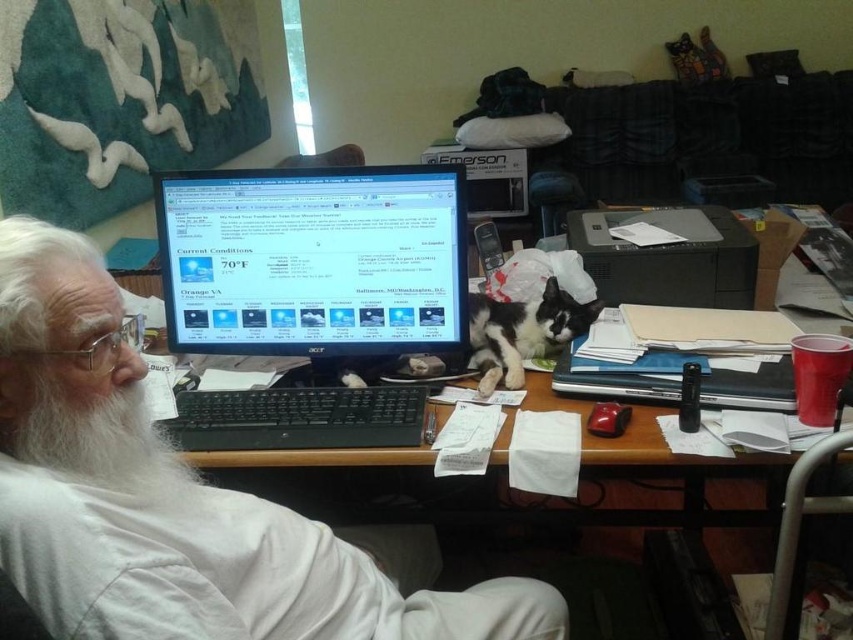
You are standing in front of the desk and notice two points marked on the desk. The first point is at coordinates point (465, 268) and the second is at point (21, 422). If you were to draw a straight line from your position to each point, which point would require you to look further back towards the desk?

Point (465, 268) is behind point (21, 422), so you would need to look further back towards the desk to see point (465, 268).

You are a delivery robot with a height of 1.5 meters. You are approaching the desk where the black glossy monitor at center is located. Can you safely pass under the desk without hitting your head?

The distance between the black glossy monitor at center and the viewer is 1.36 meters, which is less than the robot height of 1.5 meters. Therefore, the robot cannot safely pass under the desk without hitting its head.